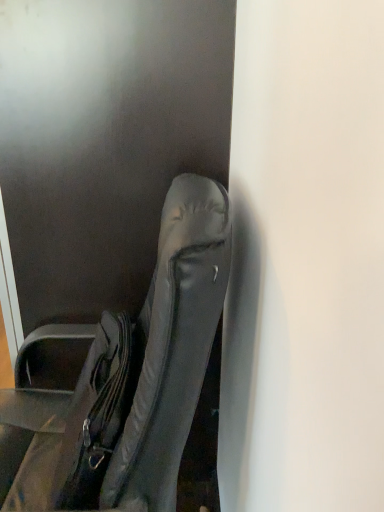
Describe the element at coordinates (128, 381) in the screenshot. This screenshot has height=512, width=384. I see `matte black guitar case at lower left` at that location.

Where is `matte black guitar case at lower left`? matte black guitar case at lower left is located at coordinates (128, 381).

Image resolution: width=384 pixels, height=512 pixels. I want to click on matte black guitar case at lower left, so click(128, 381).